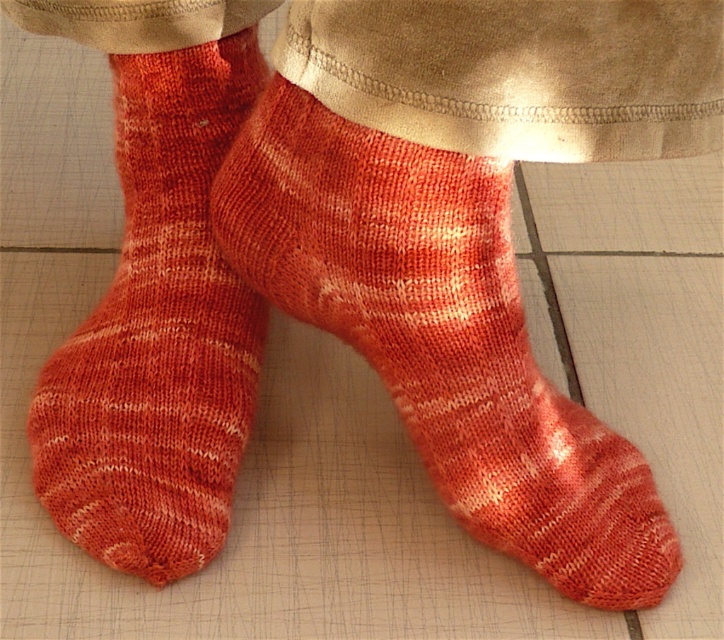
Question: Which object appears closest to the camera in this image?

Choices:
 (A) knitted woolen sock at center
 (B) knitted orange socks at center

Answer: (A)

Question: Which point is closer to the camera?

Choices:
 (A) knitted orange socks at center
 (B) knitted woolen sock at center

Answer: (B)

Question: Which point is closer to the camera?

Choices:
 (A) (279, 205)
 (B) (147, 502)

Answer: (A)

Question: Is knitted woolen sock at center below knitted orange socks at center?

Choices:
 (A) no
 (B) yes

Answer: (B)

Question: Does knitted woolen sock at center appear under knitted orange socks at center?

Choices:
 (A) no
 (B) yes

Answer: (B)

Question: Observing the image, what is the correct spatial positioning of knitted woolen sock at center in reference to knitted orange socks at center?

Choices:
 (A) left
 (B) right

Answer: (B)